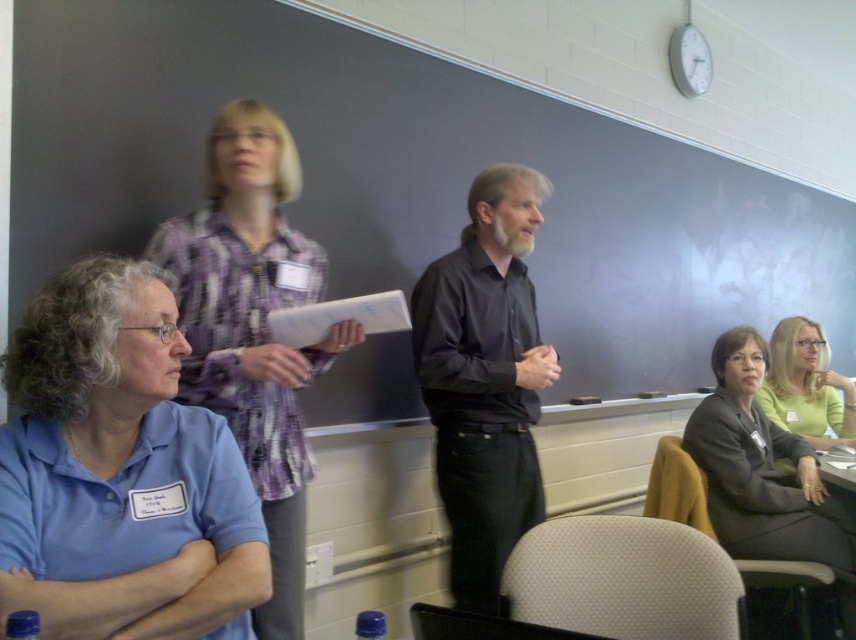
Between point (236, 115) and point (789, 336), which one is positioned in front?

Point (236, 115) is more forward.

Who is more forward, (236, 392) or (843, 403)?

Point (236, 392)

Find the location of `plaid shirt at upper left`. plaid shirt at upper left is located at coordinates (253, 326).

Which is in front, point (284, 132) or point (486, 490)?

Positioned in front is point (284, 132).

Between plaid shirt at upper left and black smooth shirt at center, which one is positioned lower?

black smooth shirt at center is lower down.

Describe the element at coordinates (253, 326) in the screenshot. I see `plaid shirt at upper left` at that location.

Where is `plaid shirt at upper left`? plaid shirt at upper left is located at coordinates (253, 326).

Is point (214, 596) farther from viewer compared to point (809, 337)?

No.

This screenshot has height=640, width=856. Identify the location of blue cotton shirt at lower left. (120, 472).

Identify the location of blue cotton shirt at lower left. This screenshot has height=640, width=856. (120, 472).